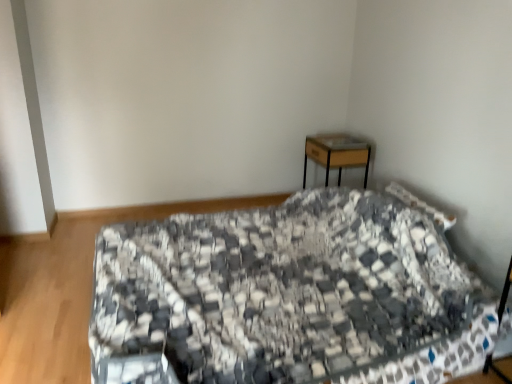
Question: From a real-world perspective, is black-and-white quilted bed at center positioned above or below wooden desk at upper right?

Choices:
 (A) above
 (B) below

Answer: (B)

Question: Is point (403, 226) positioned closer to the camera than point (333, 155)?

Choices:
 (A) closer
 (B) farther

Answer: (A)

Question: In terms of size, does black-and-white quilted bed at center appear bigger or smaller than wooden desk at upper right?

Choices:
 (A) small
 (B) big

Answer: (B)

Question: From their relative heights in the image, would you say wooden desk at upper right is taller or shorter than black-and-white quilted bed at center?

Choices:
 (A) tall
 (B) short

Answer: (B)

Question: Relative to black-and-white quilted bed at center, is wooden desk at upper right in front or behind?

Choices:
 (A) front
 (B) behind

Answer: (B)

Question: From the image's perspective, relative to black-and-white quilted bed at center, is wooden desk at upper right above or below?

Choices:
 (A) below
 (B) above

Answer: (B)

Question: Is wooden desk at upper right bigger or smaller than black-and-white quilted bed at center?

Choices:
 (A) big
 (B) small

Answer: (B)